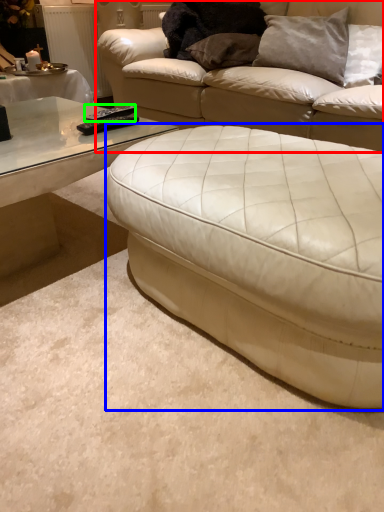
Question: Which object is positioned closest to studio couch (highlighted by a red box)? Select from studio couch (highlighted by a blue box) and remote (highlighted by a green box).

Choices:
 (A) studio couch
 (B) remote

Answer: (B)